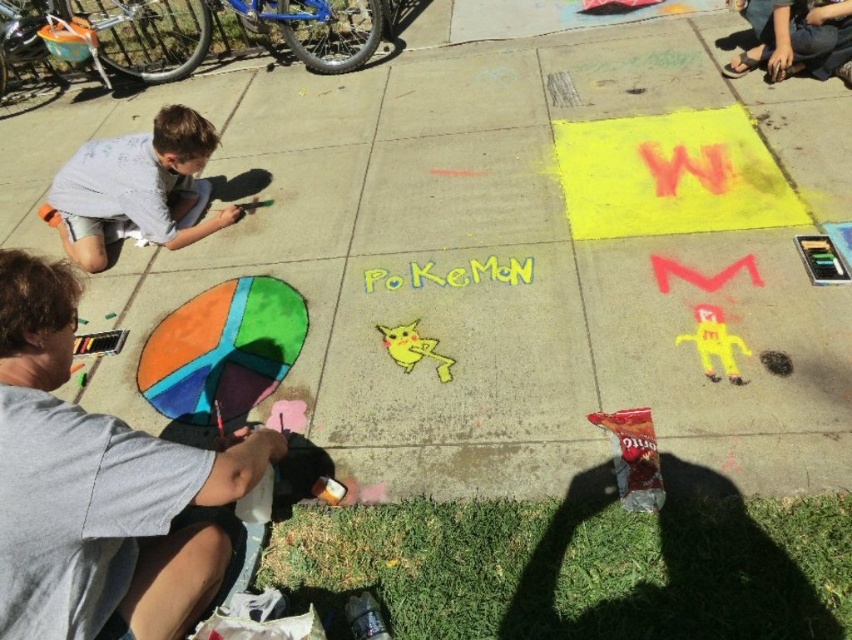
You are standing at the center of the sidewalk chalk art scene. There is a point marked at coordinates [98,488]. Which object from the scene is located at that point?

The point at coordinates [98,488] marks the location of the smooth gray shirt at lower left.

You are a photographer trying to capture the children creating sidewalk chalk art. You notice two light gray shirts in the scene. Which one is positioned lower on the image, the smooth gray shirt at lower left or the light gray shirt at upper left?

The smooth gray shirt at lower left is positioned lower on the image than the light gray shirt at upper left.

You are a photographer trying to capture the children creating chalk art. You notice two children wearing light gray shirts. Which child, the smooth gray shirt at lower left or the light gray shirt at upper left, appears taller in the photo?

The smooth gray shirt at lower left appears much taller than the light gray shirt at upper left in the photo.